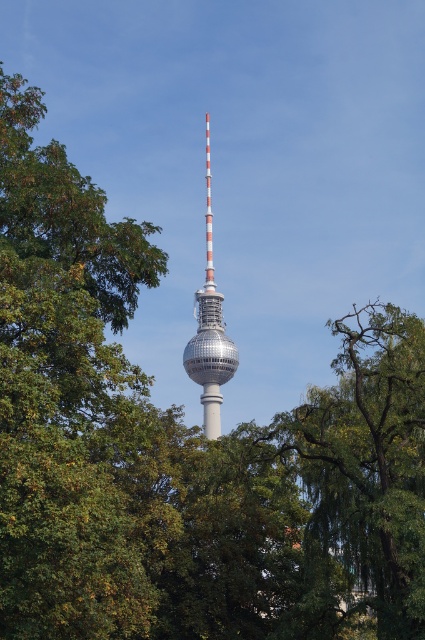
You are standing in the park and see the green leafy tree at center and the shiny metallic tower at center. Which object is positioned lower in the image?

The green leafy tree at center is located below the shiny metallic tower at center, so it is positioned lower in the image.